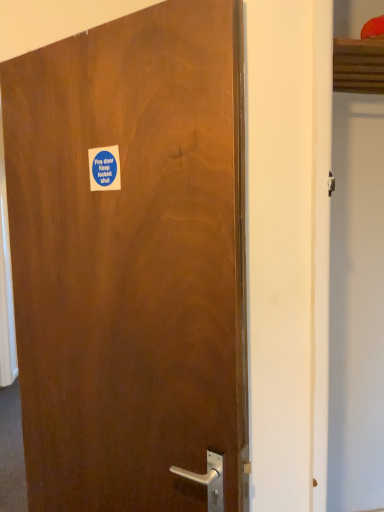
Question: Is brown matte door at center bigger or smaller than blue paper sticker at upper left?

Choices:
 (A) big
 (B) small

Answer: (A)

Question: In terms of width, does brown matte door at center look wider or thinner when compared to blue paper sticker at upper left?

Choices:
 (A) thin
 (B) wide

Answer: (B)

Question: Is brown matte door at center inside the boundaries of blue paper sticker at upper left, or outside?

Choices:
 (A) inside
 (B) outside

Answer: (B)

Question: From the image's perspective, is blue paper sticker at upper left above or below brown matte door at center?

Choices:
 (A) below
 (B) above

Answer: (B)

Question: Considering the relative positions of blue paper sticker at upper left and brown matte door at center in the image provided, is blue paper sticker at upper left to the left or to the right of brown matte door at center?

Choices:
 (A) right
 (B) left

Answer: (B)

Question: Looking at their shapes, would you say blue paper sticker at upper left is wider or thinner than brown matte door at center?

Choices:
 (A) wide
 (B) thin

Answer: (B)

Question: Is blue paper sticker at upper left in front of or behind brown matte door at center in the image?

Choices:
 (A) behind
 (B) front

Answer: (A)